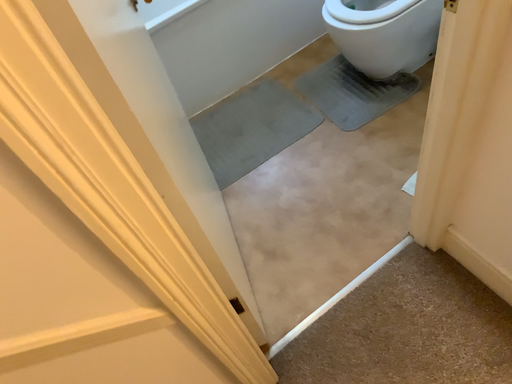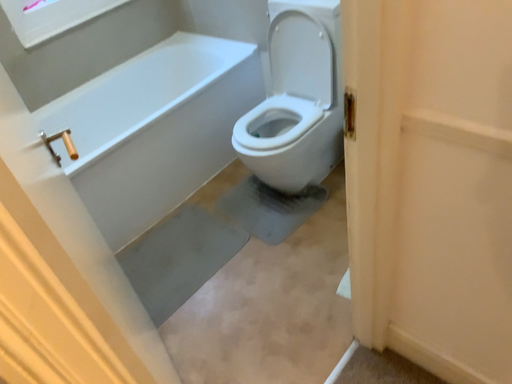
Question: Which way did the camera rotate in the video?

Choices:
 (A) rotated right
 (B) rotated left

Answer: (A)